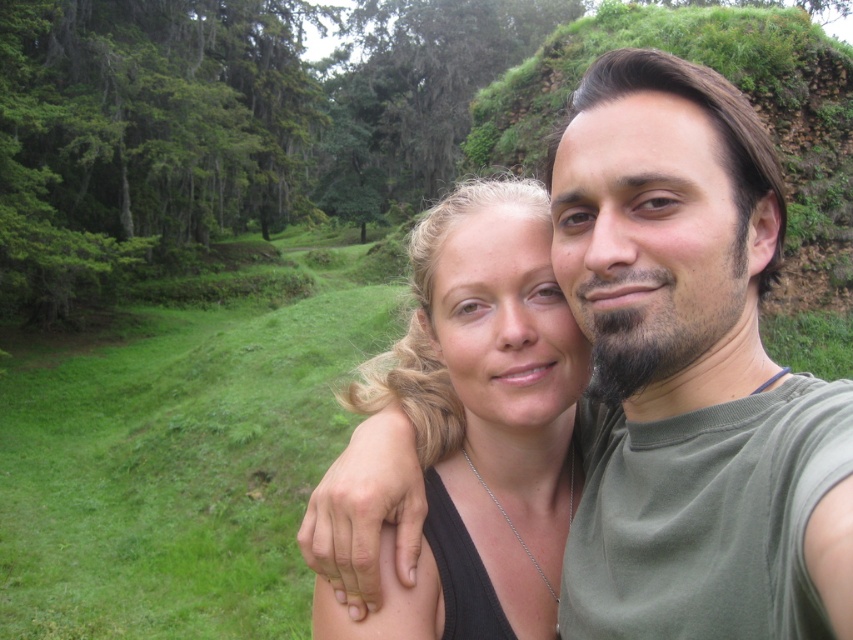
Is point (653, 241) closer to camera compared to point (393, 412)?

Yes, it is.

Is matte green shirt at center taller than black matte hair at center?

No, matte green shirt at center is not taller than black matte hair at center.

At what (x,y) coordinates should I click in order to perform the action: click on matte green shirt at center. Please return your answer as a coordinate pair (x, y). Looking at the image, I should click on (689, 372).